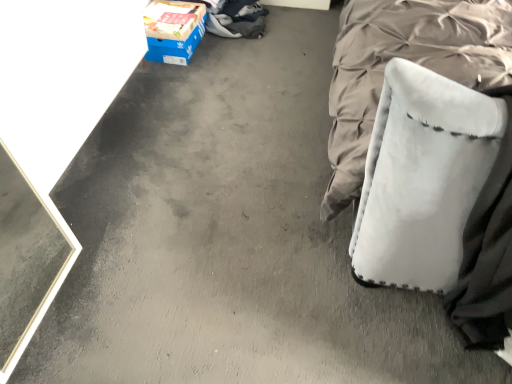
Locate an element on the screen. free location in front of blue cardboard box at upper left is located at coordinates (176, 78).